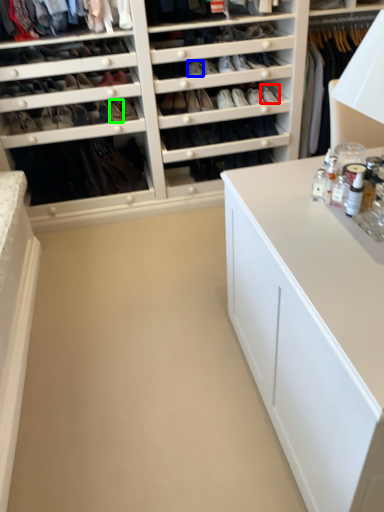
Question: Which object is the farthest from shoe (highlighted by a red box)? Choose among these: shoe (highlighted by a blue box) or shoe (highlighted by a green box).

Choices:
 (A) shoe
 (B) shoe

Answer: (B)